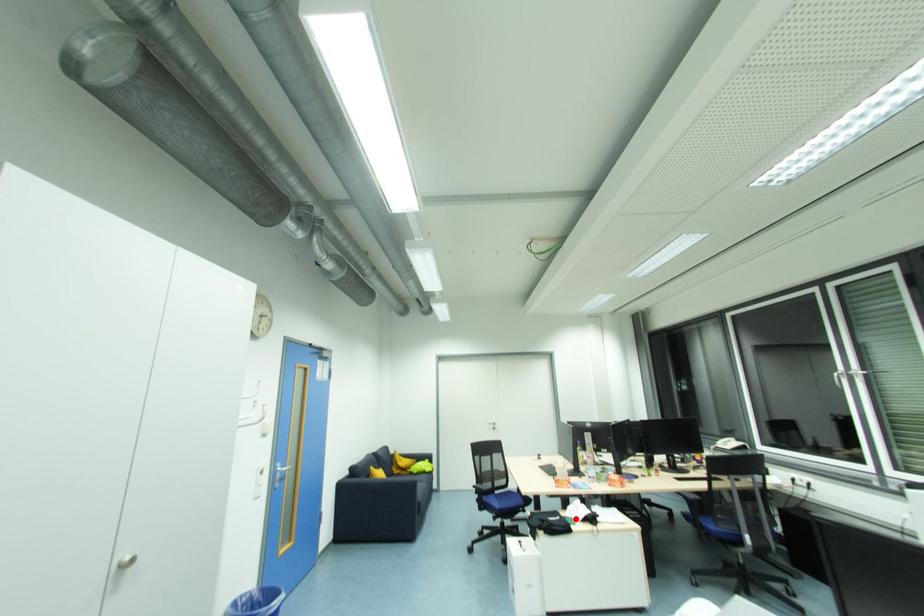
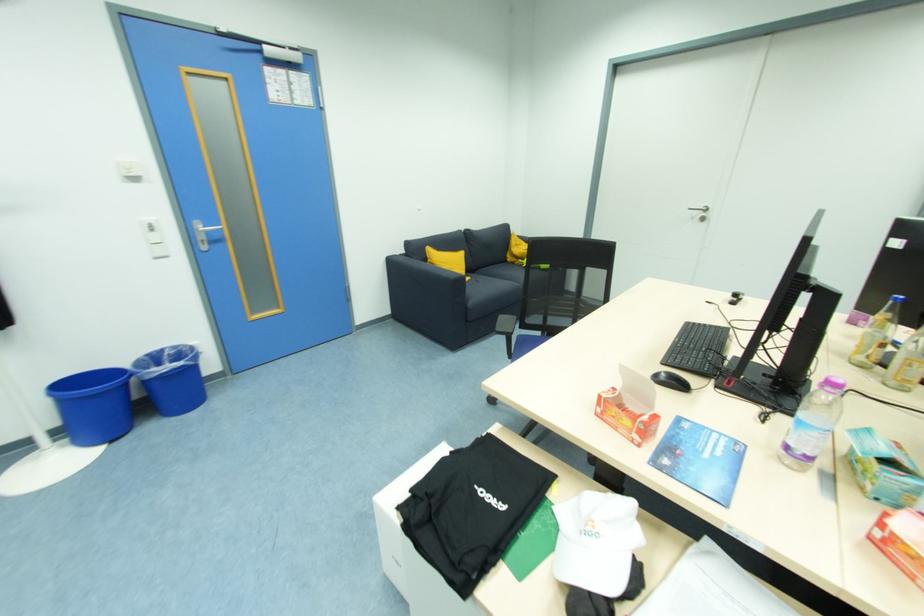
Question: I am providing you with two images of the same scene from different viewpoints. Image1 has a red point marked. In image2, the corresponding 3D location appears at what relative position? Reply with the corresponding letter.

Choices:
 (A) Closer
 (B) Farther

Answer: (A)